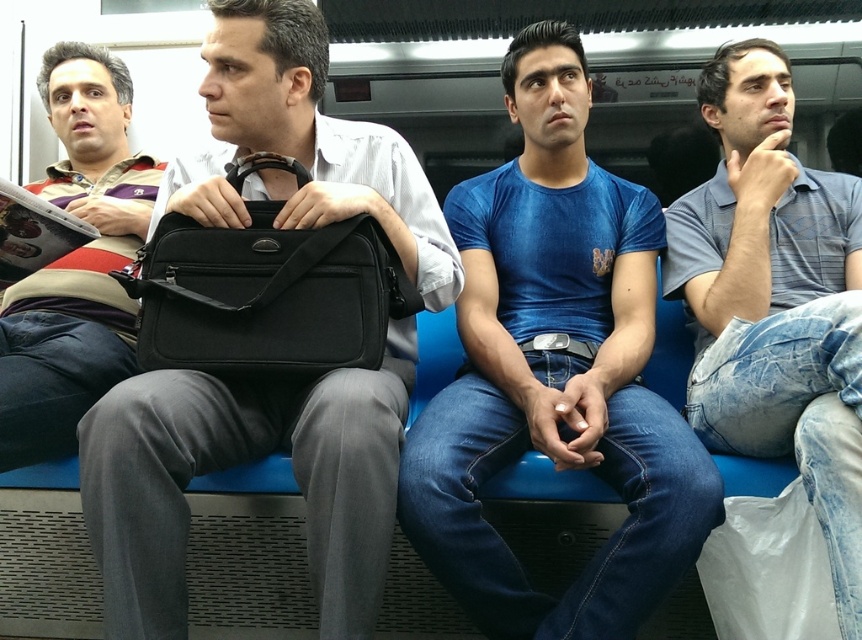
Between gray striped polo shirt at center and striped sweater at left, which one appears on the left side from the viewer's perspective?

From the viewer's perspective, striped sweater at left appears more on the left side.

Is point (692, 269) positioned after point (82, 260)?

Yes.

Is point (734, 68) in front of point (75, 147)?

Yes, point (734, 68) is closer to viewer.

The height and width of the screenshot is (640, 862). In order to click on gray striped polo shirt at center in this screenshot , I will do `click(775, 301)`.

What do you see at coordinates (554, 371) in the screenshot? The width and height of the screenshot is (862, 640). I see `blue denim jeans at center` at bounding box center [554, 371].

Can you confirm if blue denim jeans at center is bigger than black fabric briefcase at center?

Yes.

Image resolution: width=862 pixels, height=640 pixels. Find the location of `blue denim jeans at center`. blue denim jeans at center is located at coordinates (554, 371).

Where is `blue denim jeans at center`? This screenshot has width=862, height=640. blue denim jeans at center is located at coordinates (554, 371).

Does blue denim jeans at center have a larger size compared to gray striped polo shirt at center?

Indeed, blue denim jeans at center has a larger size compared to gray striped polo shirt at center.

Who is lower down, blue denim jeans at center or gray striped polo shirt at center?

Positioned lower is blue denim jeans at center.

Does point (509, 314) come behind point (773, 99)?

That is True.

Where is `blue denim jeans at center`? The width and height of the screenshot is (862, 640). blue denim jeans at center is located at coordinates (554, 371).